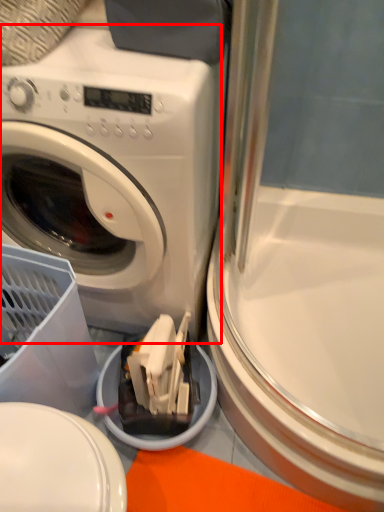
Question: From the image's perspective, what is the correct spatial positioning of washing machine (annotated by the red box) in reference to screen door?

Choices:
 (A) below
 (B) above

Answer: (B)